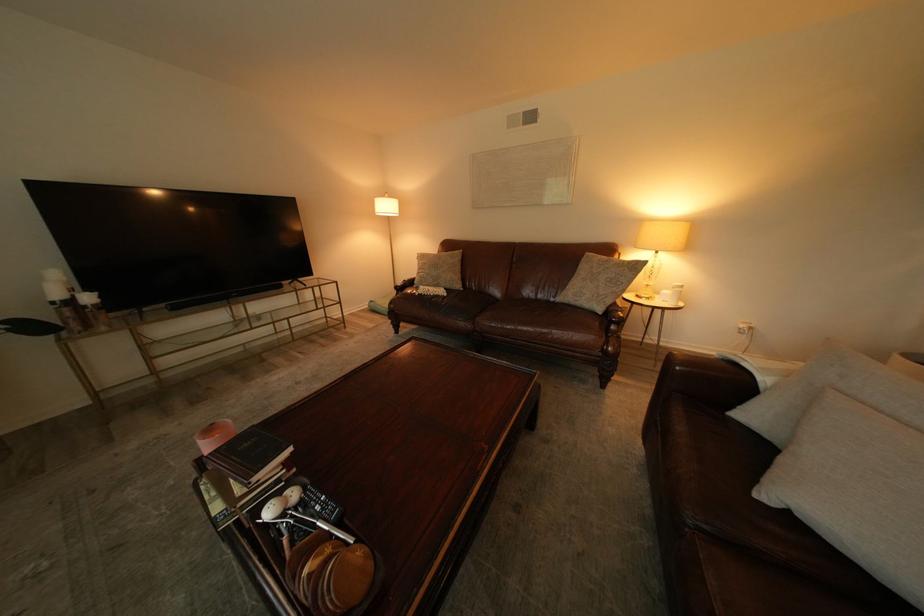
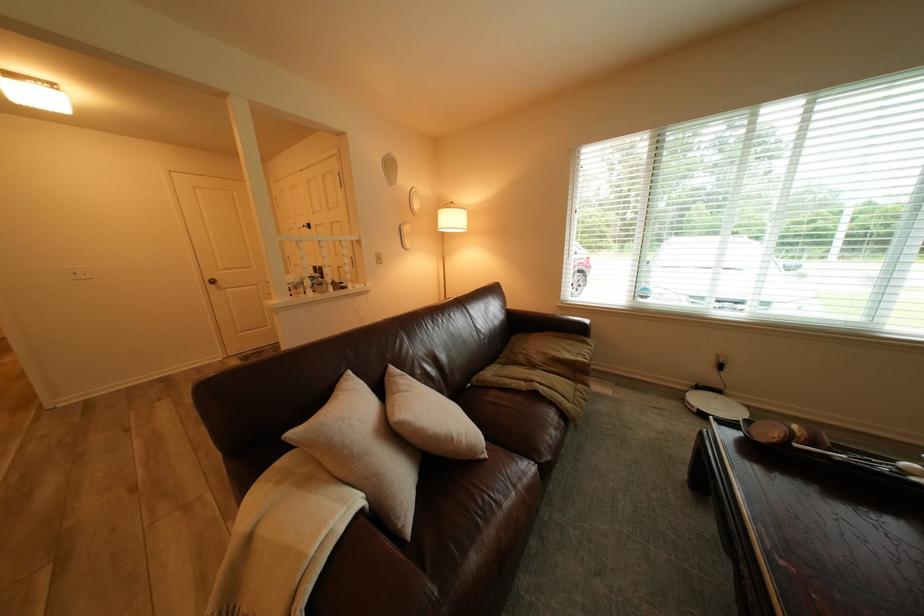
Locate, in the second image, the point that corresponds to point (780, 381) in the first image.

(372, 500)